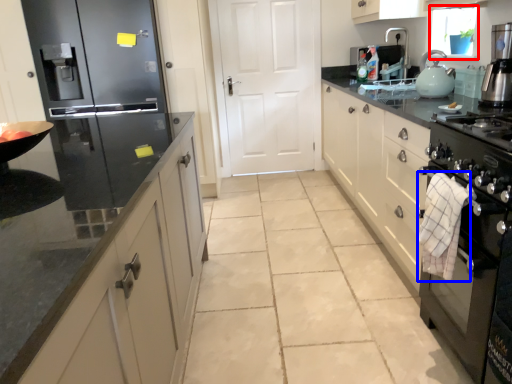
Question: Which object is further to the camera taking this photo, window screen (highlighted by a red box) or cloth (highlighted by a blue box)?

Choices:
 (A) window screen
 (B) cloth

Answer: (A)